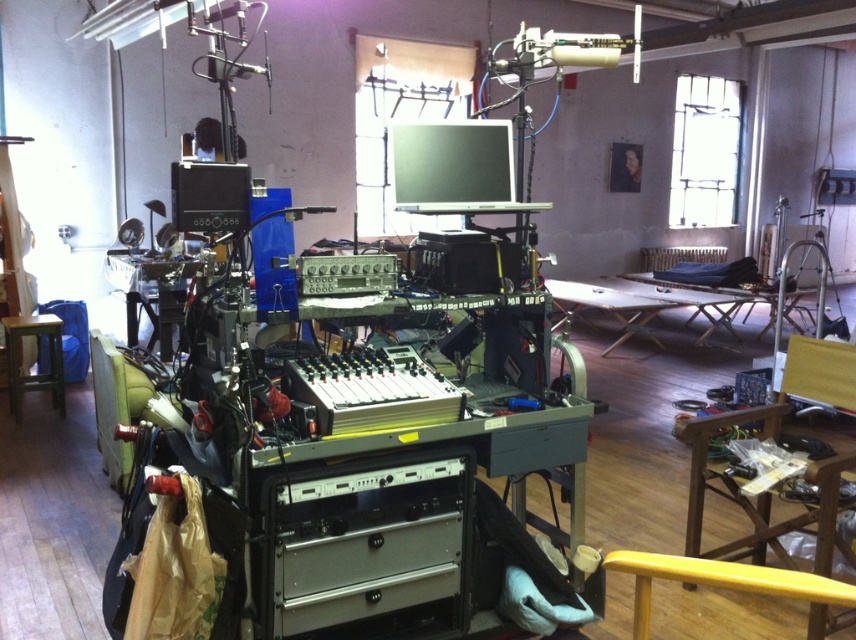
You are a technician needing to adjust the settings on the monitor mounted above the wooden folding table at center. You have a tool that requires a stable surface. Can you place the tool on the wooden stool at lower left while you work?

The wooden folding table at center is taller than the wooden stool at lower left. Since the monitor is above the table, the stool is shorter and might not provide a stable or convenient height for placing the tool while adjusting the monitor. It would be better to use the table itself or another surface at a similar height.

You are a technician who needs to move from the wooden stool at lower left to the wooden folding table at center to adjust some wires. Given that the distance between them is 15.71 feet, can you estimate how many steps you would need to take if each step covers approximately 2.5 feet?

The distance between the wooden folding table at center and the wooden stool at lower left is 15.71 feet. If each step covers about 2.5 feet, dividing 15.71 by 2.5 gives approximately 6.28 steps. Since you can only take whole steps, you would need to take 7 steps to cover the distance.